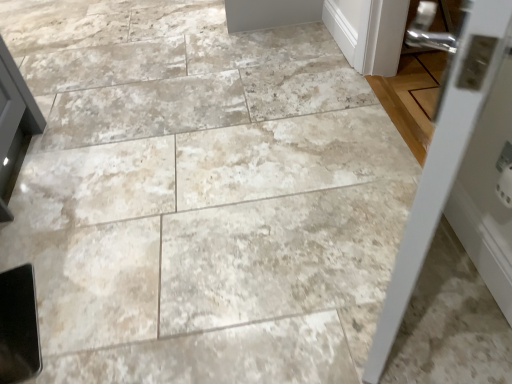
You are a GUI agent. You are given a task and a screenshot of the screen. Output one action in this format:
    pyautogui.click(x=<x>, y=<y>)
    Task: Click on the vacant area situated below white glossy door at right, which is the second door from top to bottom (from a real-world perspective)
    This screenshot has height=384, width=512.
    Given the screenshot: What is the action you would take?
    pyautogui.click(x=384, y=277)